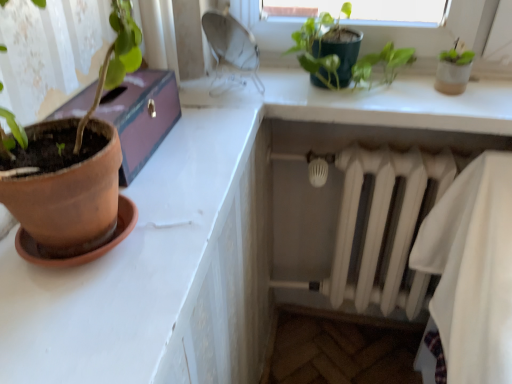
At what (x,y) coordinates should I click in order to perform the action: click on blank space situated above terracotta clay pot at left (from a real-world perspective). Please return your answer as a coordinate pair (x, y). Looking at the image, I should click on (186, 165).